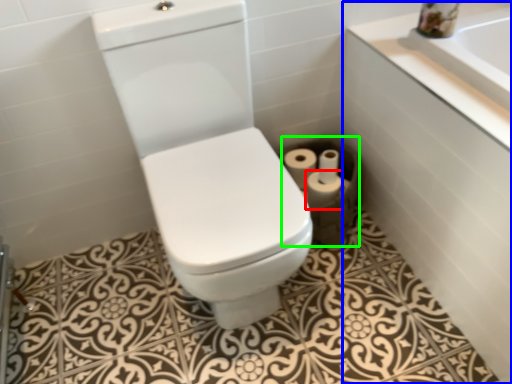
Question: Which is nearer to the toilet paper (highlighted by a red box)? bath (highlighted by a blue box) or toilet paper (highlighted by a green box).

Choices:
 (A) bath
 (B) toilet paper

Answer: (B)